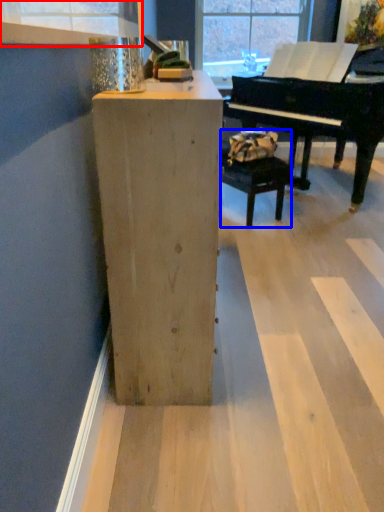
Question: Which point is closer to the camera, window frame (highlighted by a red box) or armchair (highlighted by a blue box)?

Choices:
 (A) window frame
 (B) armchair

Answer: (A)